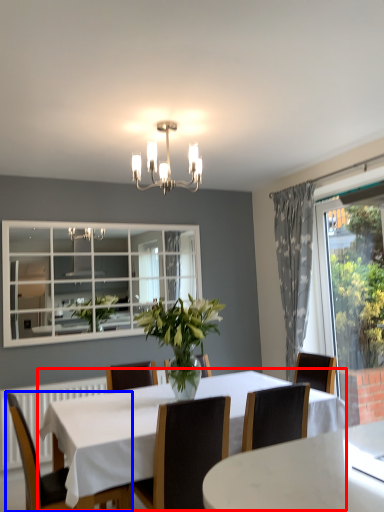
Question: Which object is further to the camera taking this photo, kitchen & dining room table (highlighted by a red box) or chair (highlighted by a blue box)?

Choices:
 (A) kitchen & dining room table
 (B) chair

Answer: (B)